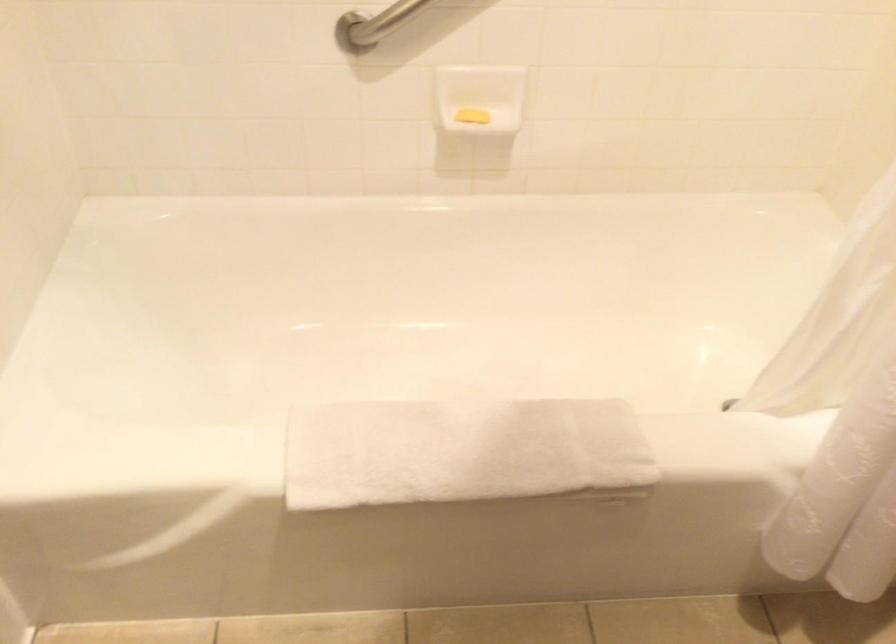
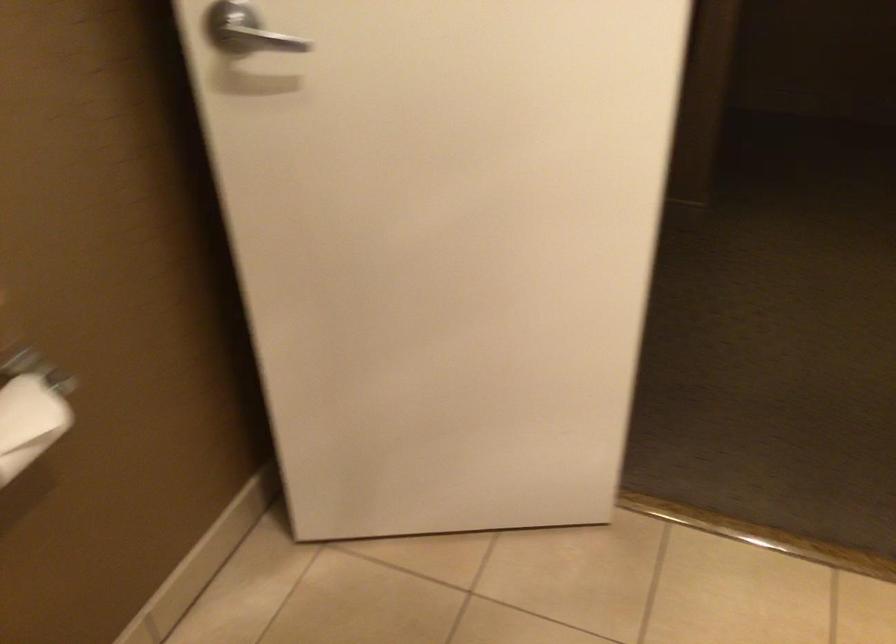
How did the camera likely rotate?

The camera's rotation is toward left-down.